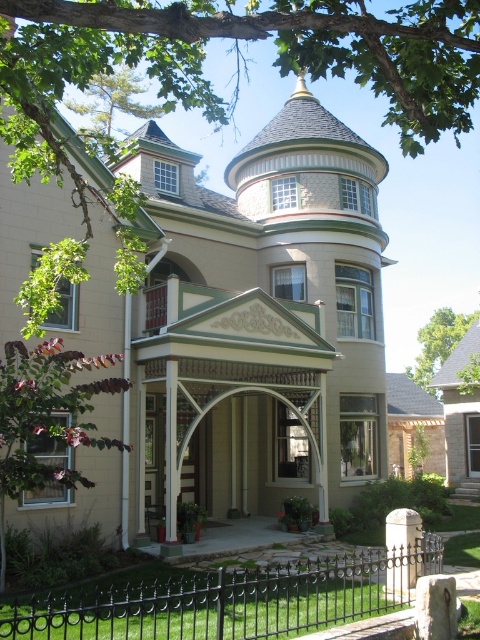
Is point (100, 611) closer to viewer compared to point (415, 509)?

Yes, it is.

Which is more to the left, black wrought iron fence at lower center or white stone pillar at lower right?

black wrought iron fence at lower center

What are the coordinates of `black wrought iron fence at lower center` in the screenshot? It's located at (228, 598).